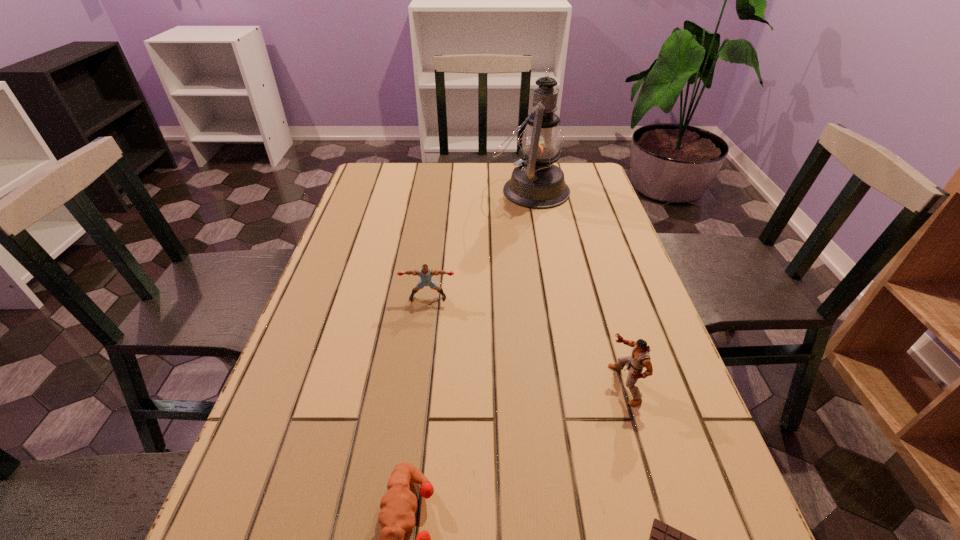
Find the location of `vacant space situated on the front-facing side of the third tallest object`. vacant space situated on the front-facing side of the third tallest object is located at coordinates (410, 438).

The height and width of the screenshot is (540, 960). What are the coordinates of `object that is positioned at the far edge` in the screenshot? It's located at (537, 183).

Identify the location of oil lamp positioned at the right edge. The width and height of the screenshot is (960, 540). (537, 183).

Locate an element on the screen. puncher located at the right edge is located at coordinates (640, 358).

Identify the location of object positioned at the far right corner. (537, 183).

In the image, there is a desktop. At what (x,y) coordinates should I click in order to perform the action: click on vacant space at the left edge. Please return your answer as a coordinate pair (x, y). Looking at the image, I should click on (300, 421).

This screenshot has height=540, width=960. In order to click on free space at the right edge of the desktop in this screenshot , I will do `click(644, 302)`.

I want to click on blank space at the far left corner of the desktop, so click(x=373, y=173).

The height and width of the screenshot is (540, 960). I want to click on blank space at the far right corner of the desktop, so 590,180.

Identify the location of vacant point located between the farthest object and the farthest puncher. The width and height of the screenshot is (960, 540). (479, 244).